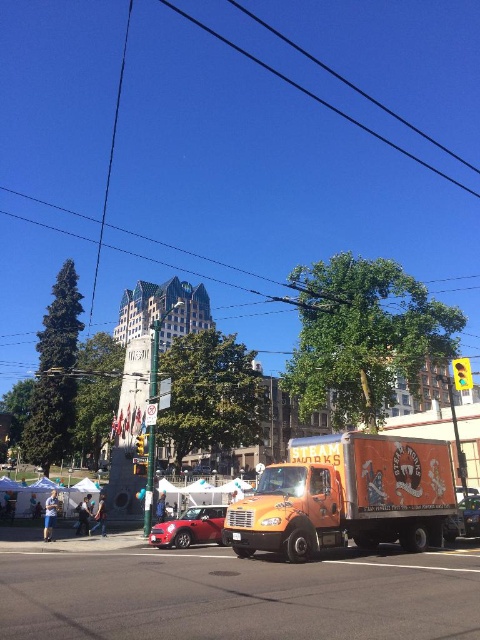
You are a delivery driver who needs to pass under a low bridge that has a height limit of 2 meters. You are currently driving the shiny red car at center and see the orange matte food truck at center parked nearby. Can you estimate whether your car is taller than the height limit based on the scene?

The orange matte food truck at center is much taller than the shiny red car at center. Since the food truck is taller than the car, the car is likely under the 2 meters height limit and can pass under the bridge.